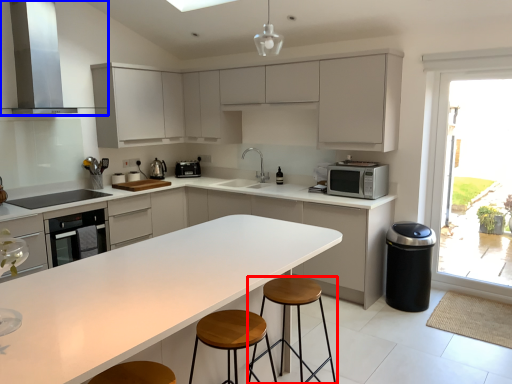
Question: Which object appears farthest to the camera in this image, stool (highlighted by a red box) or home appliance (highlighted by a blue box)?

Choices:
 (A) stool
 (B) home appliance

Answer: (B)